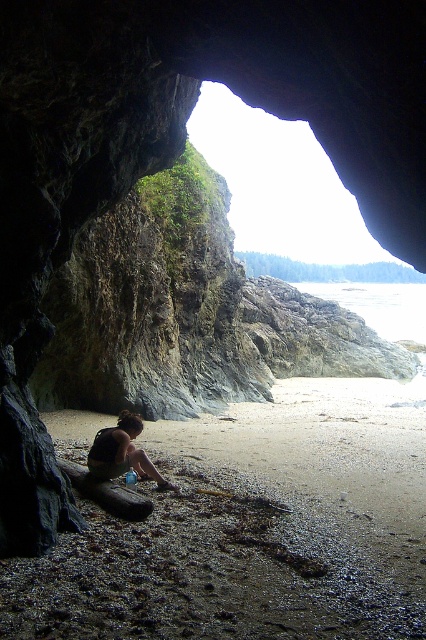
You are standing inside the cave and want to exit to the beach. Based on the scene, which object is lower in height, the sandy beach at lower center or the dark brown skin at center?

The sandy beach at lower center has a lesser height compared to the dark brown skin at center, so the sandy beach at lower center is lower in height.

You are standing inside the cave and want to exit to the beach. Which object, the sandy beach at lower center or the dark brown skin at center, is closer to the exit?

The sandy beach at lower center is closer to the exit than the dark brown skin at center because it is nearer to the cave entrance.